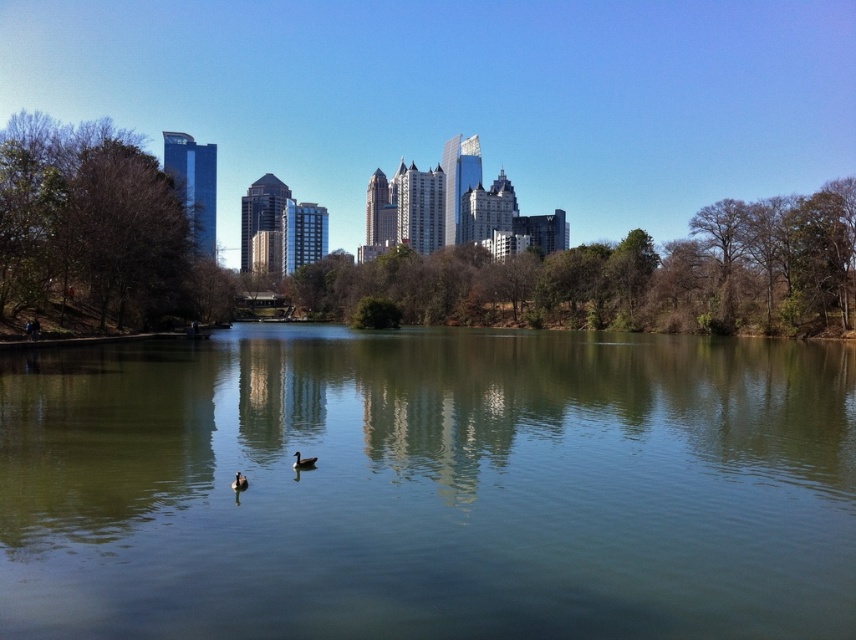
You are a photographer aiming to capture the reflection of the skyscrapers in the green smooth water at center. However, there is a brown matte duck at lower center nearby. Will the duck obstruct the reflection of the skyscrapers in the water?

The green smooth water at center might be wider than brown matte duck at lower center, so the duck may not fully block the reflection of the skyscrapers in the water.